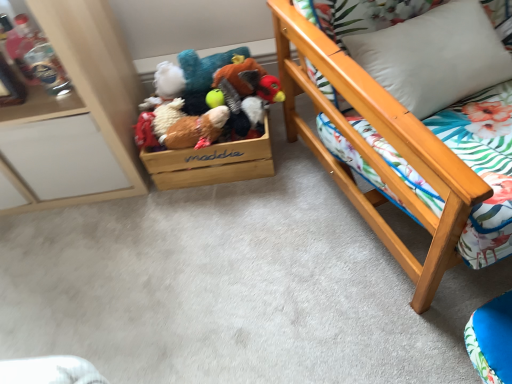
Question: Is white soft pillow at upper right behind wooden cabinet at left, the 1th furniture from the left?

Choices:
 (A) no
 (B) yes

Answer: (A)

Question: Is white soft pillow at upper right bigger than wooden cabinet at left, positioned as the second furniture in right-to-left order?

Choices:
 (A) yes
 (B) no

Answer: (B)

Question: Is wooden cabinet at left, the 1th furniture from the left, a part of white soft pillow at upper right?

Choices:
 (A) no
 (B) yes

Answer: (A)

Question: Considering the relative positions of white soft pillow at upper right and wooden cabinet at left, positioned as the second furniture in right-to-left order, in the image provided, is white soft pillow at upper right to the left of wooden cabinet at left, positioned as the second furniture in right-to-left order, from the viewer's perspective?

Choices:
 (A) yes
 (B) no

Answer: (B)

Question: From the image's perspective, is white soft pillow at upper right beneath wooden cabinet at left, the 1th furniture from the left?

Choices:
 (A) yes
 (B) no

Answer: (B)

Question: Would you say white soft pillow at upper right is a long distance from wooden cabinet at left, positioned as the second furniture in right-to-left order?

Choices:
 (A) no
 (B) yes

Answer: (A)

Question: Is wooden cabinet at left, positioned as the second furniture in right-to-left order, facing away from fluffy brown plush at center, marked as the second toy in a back-to-front arrangement?

Choices:
 (A) no
 (B) yes

Answer: (A)

Question: Does wooden cabinet at left, positioned as the second furniture in right-to-left order, have a lesser width compared to fluffy brown plush at center, acting as the first toy starting from the front?

Choices:
 (A) no
 (B) yes

Answer: (A)

Question: Considering the relative positions of wooden cabinet at left, positioned as the second furniture in right-to-left order, and fluffy brown plush at center, acting as the first toy starting from the front, in the image provided, is wooden cabinet at left, positioned as the second furniture in right-to-left order, to the left of fluffy brown plush at center, acting as the first toy starting from the front, from the viewer's perspective?

Choices:
 (A) yes
 (B) no

Answer: (A)

Question: Is wooden cabinet at left, the 1th furniture from the left, with fluffy brown plush at center, marked as the second toy in a back-to-front arrangement?

Choices:
 (A) yes
 (B) no

Answer: (B)

Question: From a real-world perspective, is wooden cabinet at left, the 1th furniture from the left, positioned over fluffy brown plush at center, acting as the first toy starting from the front, based on gravity?

Choices:
 (A) no
 (B) yes

Answer: (B)

Question: Does wooden cabinet at left, the 1th furniture from the left, have a smaller size compared to fluffy brown plush at center, acting as the first toy starting from the front?

Choices:
 (A) yes
 (B) no

Answer: (B)

Question: Does fluffy brown plush at center, acting as the first toy starting from the front, have a lesser width compared to wooden bed frame at right, arranged as the 2th furniture when viewed from the left?

Choices:
 (A) no
 (B) yes

Answer: (B)